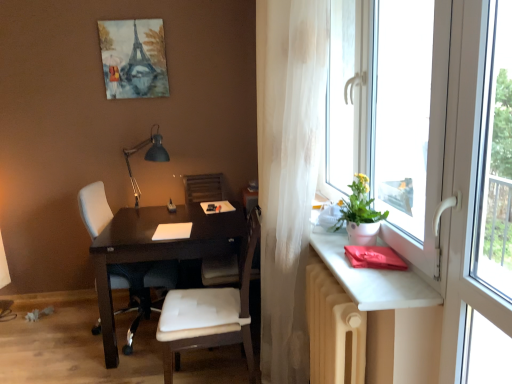
Question: In terms of height, does white leather chair at center, which appears as the first chair when viewed from the right, look taller or shorter compared to translucent white curtain at right?

Choices:
 (A) tall
 (B) short

Answer: (B)

Question: Is white leather chair at center, which is the second chair from left to right, in front of or behind translucent white curtain at right in the image?

Choices:
 (A) behind
 (B) front

Answer: (A)

Question: Estimate the real-world distances between objects in this image. Which object is farther from the white plastic window at right?

Choices:
 (A) matte white table at right
 (B) watercolor paper painting at upper center
 (C) white matte pot at window
 (D) white leather chair at center, which is the second chair from back to front
 (E) wooden armchair at center

Answer: (B)

Question: Which object is the closest to the white leather chair at center, which appears as the first chair when viewed from the right?

Choices:
 (A) matte metal desk lamp at upper left
 (B) beige radiator at lower right
 (C) white plastic window at right
 (D) white leather chair at center, which appears as the 1th chair when viewed from the left
 (E) wooden armchair at center

Answer: (B)